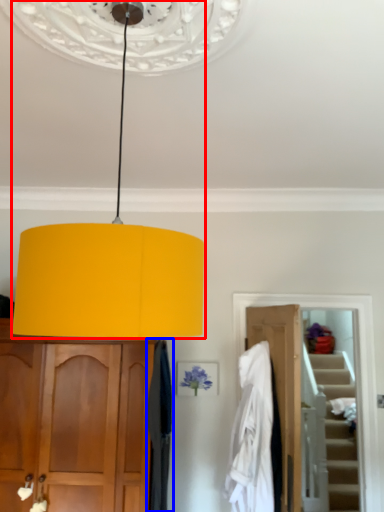
Question: Which point is closer to the camera, lamp (highlighted by a red box) or curtain (highlighted by a blue box)?

Choices:
 (A) lamp
 (B) curtain

Answer: (A)